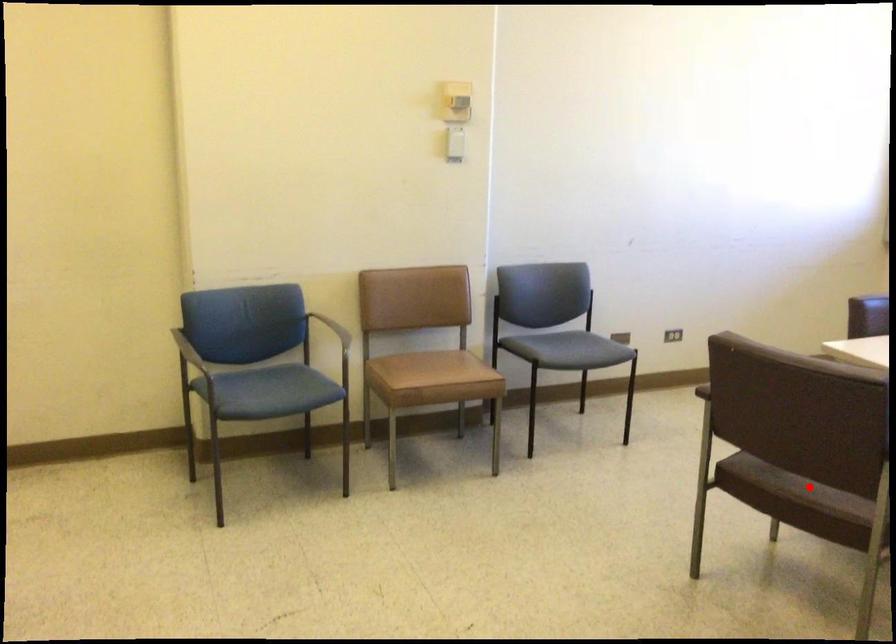
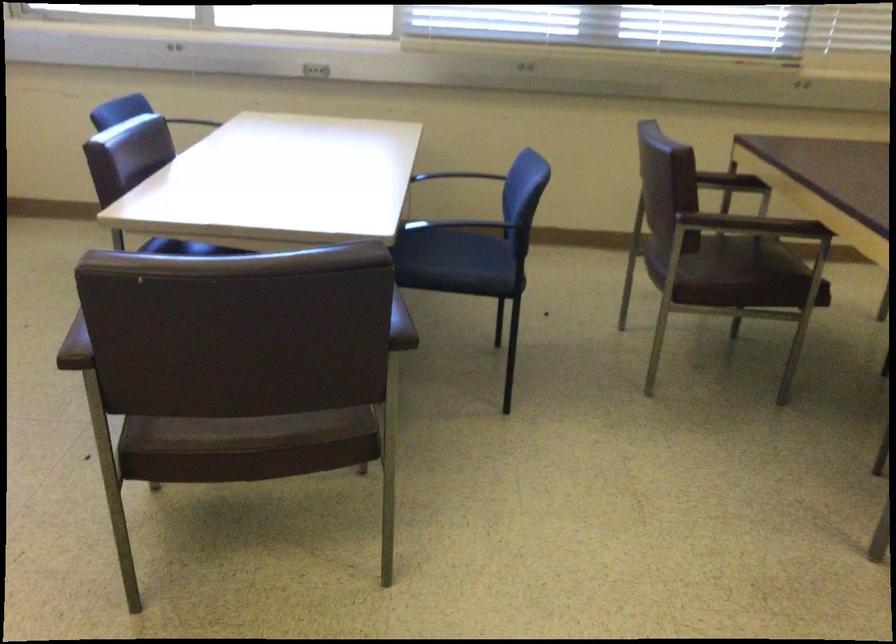
The point at the highlighted location is marked in the first image. Where is the corresponding point in the second image?

(254, 431)